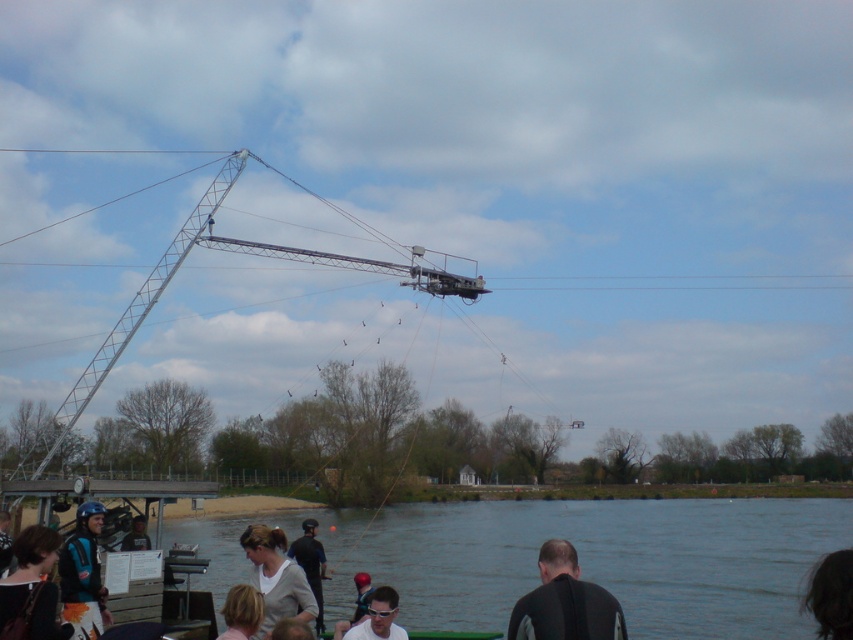
Question: Is dark brown leather jacket at lower left below dark brown hair at lower right?

Choices:
 (A) yes
 (B) no

Answer: (A)

Question: Which of the following is the closest to the observer?

Choices:
 (A) (250, 545)
 (B) (352, 627)

Answer: (B)

Question: Does light gray fabric shirt at lower center appear over dark gray fabric jacket at lower left?

Choices:
 (A) no
 (B) yes

Answer: (A)

Question: Which of these objects is positioned closest to the black wetsuit at lower center?

Choices:
 (A) teal matte helmet at lower left
 (B) dark brown hair at lower right
 (C) dark brown leather jacket at lower left
 (D) metallic gray crane at upper center

Answer: (B)

Question: Which of the following is the farthest from the observer?

Choices:
 (A) blue helmet at lower left
 (B) dark gray fabric jacket at lower left

Answer: (B)

Question: Can you confirm if teal matte helmet at lower left is positioned to the left of dark gray fabric jacket at lower left?

Choices:
 (A) yes
 (B) no

Answer: (A)